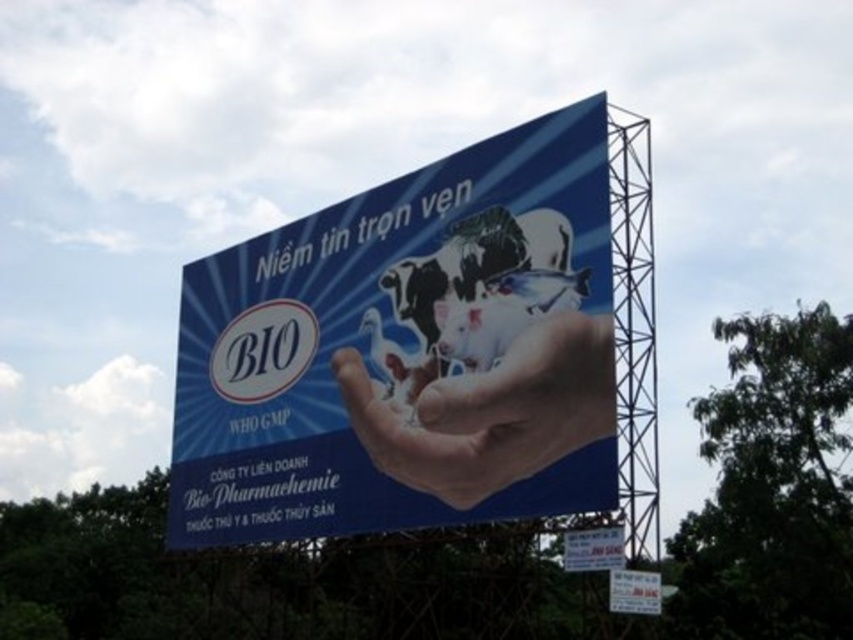
Based on the photo, you are an airplane pilot approaching the billboard from the sky. You see two points on the billboard, one at coordinates point (274, 316) and the other at point (502, 483). Which point is closer to you as you fly over the billboard?

Point (502, 483) is closer to you because point (274, 316) is behind it.

What are the coordinates of the blue matte billboard at center?

The coordinates of the blue matte billboard at center are at point [407,352].

You are an artist who wants to paint a scene similar to the one in the image. You have a canvas that can only fit objects up to the size of the smooth skin hand at center. Can you paint the blue matte billboard at center on your canvas?

The blue matte billboard at center is larger than the smooth skin hand at center. Since your canvas can only fit objects up to the size of the smooth skin hand at center, you cannot paint the blue matte billboard at center on your canvas.